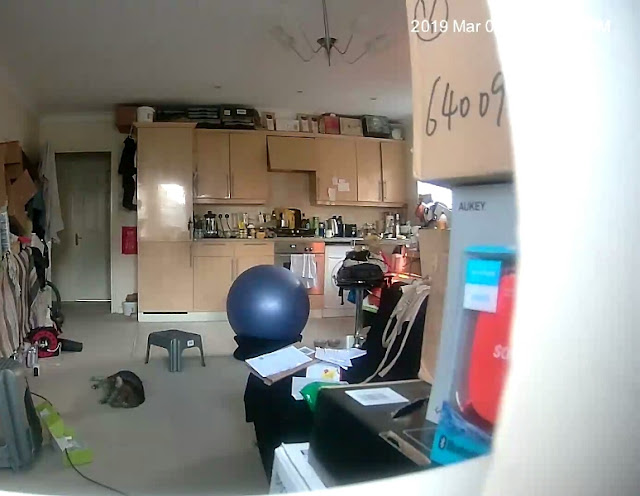
The height and width of the screenshot is (496, 640). I want to click on step stool, so click(x=175, y=340).